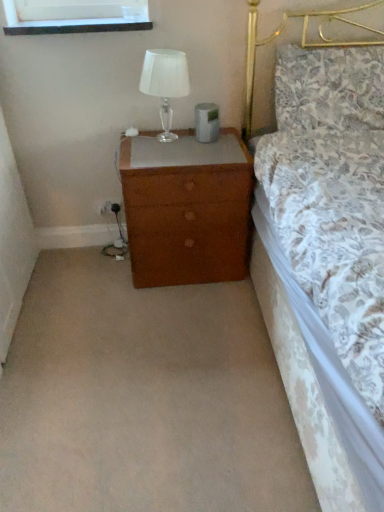
I want to click on brown wood nightstand at lower center, so click(x=144, y=398).

Locate an element on the screen. The width and height of the screenshot is (384, 512). clear glass table lamp at upper right is located at coordinates (165, 83).

Identify the location of brown wood chest of drawers at center. The width and height of the screenshot is (384, 512). (186, 209).

Where is `brown wood nightstand at lower center`? The image size is (384, 512). brown wood nightstand at lower center is located at coordinates (144, 398).

What's the angular difference between floral fabric pillow at upper right and clear glass table lamp at upper right's facing directions?

The facing directions of floral fabric pillow at upper right and clear glass table lamp at upper right are 0.474 degrees apart.

Is floral fabric pillow at upper right facing towards clear glass table lamp at upper right?

No.

From the image's perspective, between floral fabric pillow at upper right and clear glass table lamp at upper right, who is located below?

clear glass table lamp at upper right appears lower in the image.

From a real-world perspective, is floral fabric pillow at upper right located beneath clear glass table lamp at upper right?

Actually, floral fabric pillow at upper right is physically above clear glass table lamp at upper right in the real world.

Who is more distant, clear glass table lamp at upper right or floral fabric pillow at upper right?

floral fabric pillow at upper right.

Which of these two, clear glass table lamp at upper right or floral fabric pillow at upper right, is smaller?

Smaller between the two is clear glass table lamp at upper right.

Where is `chest of drawers below the floral fabric pillow at upper right (from a real-world perspective)`? The width and height of the screenshot is (384, 512). chest of drawers below the floral fabric pillow at upper right (from a real-world perspective) is located at coordinates (186, 209).

Choose the correct answer: Is floral fabric pillow at upper right inside brown wood chest of drawers at center or outside it?

floral fabric pillow at upper right cannot be found inside brown wood chest of drawers at center.

Based on the photo, can you confirm if floral fabric pillow at upper right is shorter than brown wood chest of drawers at center?

Yes, floral fabric pillow at upper right is shorter than brown wood chest of drawers at center.

Considering the relative sizes of brown wood nightstand at lower center and brown wood chest of drawers at center in the image provided, is brown wood nightstand at lower center smaller than brown wood chest of drawers at center?

Yes.

Is brown wood chest of drawers at center at the back of brown wood nightstand at lower center?

That's right, brown wood nightstand at lower center is facing away from brown wood chest of drawers at center.

Is brown wood nightstand at lower center wider than brown wood chest of drawers at center?

Yes, brown wood nightstand at lower center is wider than brown wood chest of drawers at center.

Is brown wood nightstand at lower center behind brown wood chest of drawers at center?

No, brown wood nightstand at lower center is closer to the viewer.

What's the angular difference between clear glass table lamp at upper right and brown wood chest of drawers at center's facing directions?

The facing directions of clear glass table lamp at upper right and brown wood chest of drawers at center are 0.033 degrees apart.

Is clear glass table lamp at upper right far from brown wood chest of drawers at center?

clear glass table lamp at upper right is actually quite close to brown wood chest of drawers at center.

How much distance is there between clear glass table lamp at upper right and brown wood chest of drawers at center?

The distance of clear glass table lamp at upper right from brown wood chest of drawers at center is 15.03 inches.

Which is behind, point (169, 96) or point (213, 146)?

Point (213, 146)

Considering the relative sizes of floral fabric pillow at upper right and brown wood nightstand at lower center in the image provided, is floral fabric pillow at upper right shorter than brown wood nightstand at lower center?

No.

Considering the points (320, 90) and (169, 343), which point is in front, point (320, 90) or point (169, 343)?

The point (169, 343) is closer to the camera.

Could you tell me if floral fabric pillow at upper right is facing brown wood nightstand at lower center?

No, floral fabric pillow at upper right does not turn towards brown wood nightstand at lower center.

Does brown wood chest of drawers at center turn towards brown wood nightstand at lower center?

Yes, brown wood chest of drawers at center is aimed at brown wood nightstand at lower center.

Considering the relative positions of brown wood chest of drawers at center and brown wood nightstand at lower center in the image provided, is brown wood chest of drawers at center to the left or to the right of brown wood nightstand at lower center?

brown wood chest of drawers at center is positioned on brown wood nightstand at lower center's right side.

From the image's perspective, is brown wood chest of drawers at center under brown wood nightstand at lower center?

No, from the image's perspective, brown wood chest of drawers at center is not below brown wood nightstand at lower center.

Between brown wood chest of drawers at center and brown wood nightstand at lower center, which one has less height?

brown wood nightstand at lower center is shorter.

Find the location of a particular element. The width and height of the screenshot is (384, 512). table lamp below the floral fabric pillow at upper right (from a real-world perspective) is located at coordinates (165, 83).

This screenshot has width=384, height=512. Find the location of `table lamp located on the left of floral fabric pillow at upper right`. table lamp located on the left of floral fabric pillow at upper right is located at coordinates (165, 83).

Considering their positions, is floral fabric pillow at upper right positioned further to clear glass table lamp at upper right than brown wood nightstand at lower center?

brown wood nightstand at lower center lies further to clear glass table lamp at upper right than the other object.

Looking at the image, which one is located closer to floral fabric pillow at upper right, clear glass table lamp at upper right or brown wood nightstand at lower center?

clear glass table lamp at upper right is closer to floral fabric pillow at upper right.

Which object lies further to the anchor point clear glass table lamp at upper right, brown wood chest of drawers at center or floral fabric pillow at upper right?

floral fabric pillow at upper right is further to clear glass table lamp at upper right.

Considering their positions, is clear glass table lamp at upper right positioned closer to brown wood nightstand at lower center than floral fabric pillow at upper right?

clear glass table lamp at upper right lies closer to brown wood nightstand at lower center than the other object.

Looking at the image, which one is located closer to brown wood nightstand at lower center, brown wood chest of drawers at center or clear glass table lamp at upper right?

brown wood chest of drawers at center.

Considering their positions, is floral fabric pillow at upper right positioned further to brown wood chest of drawers at center than clear glass table lamp at upper right?

floral fabric pillow at upper right is positioned further to the anchor brown wood chest of drawers at center.

From the picture: When comparing their distances from brown wood nightstand at lower center, does floral fabric pillow at upper right or brown wood chest of drawers at center seem closer?

brown wood chest of drawers at center lies closer to brown wood nightstand at lower center than the other object.

Looking at the image, which one is located closer to clear glass table lamp at upper right, floral fabric pillow at upper right or brown wood chest of drawers at center?

Among the two, brown wood chest of drawers at center is located nearer to clear glass table lamp at upper right.

Locate an element on the screen. The height and width of the screenshot is (512, 384). the chest of drawers situated between clear glass table lamp at upper right and floral fabric pillow at upper right from left to right is located at coordinates (186, 209).

Locate an element on the screen. table lamp between floral fabric pillow at upper right and brown wood nightstand at lower center from top to bottom is located at coordinates (165, 83).

What are the coordinates of `chest of drawers between clear glass table lamp at upper right and brown wood nightstand at lower center in the vertical direction` in the screenshot? It's located at (186, 209).

You are a GUI agent. You are given a task and a screenshot of the screen. Output one action in this format:
    pyautogui.click(x=<x>, y=<y>)
    Task: Click on the chest of drawers between floral fabric pillow at upper right and brown wood nightstand at lower center in the vertical direction
    
    Given the screenshot: What is the action you would take?
    pyautogui.click(x=186, y=209)